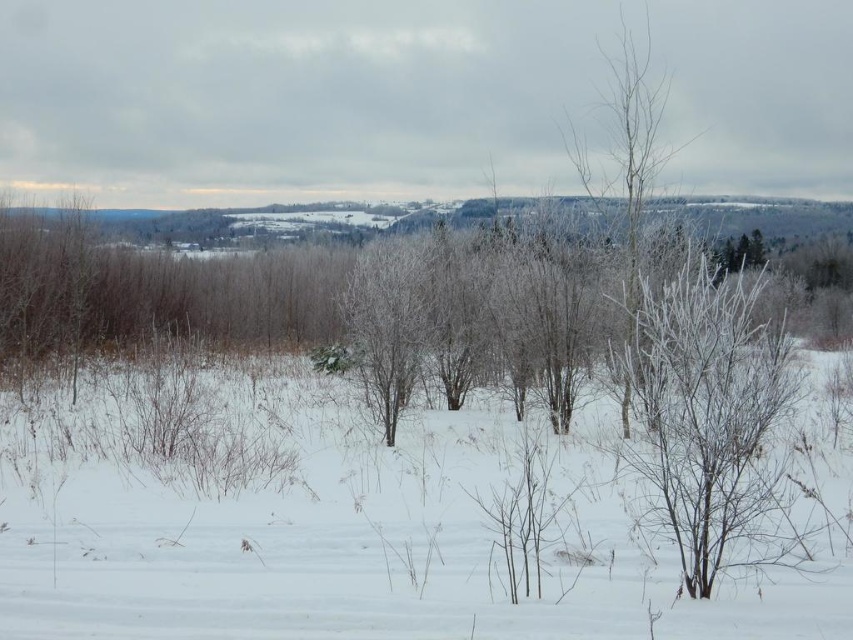
Question: Which of the following is the farthest from the observer?

Choices:
 (A) frosted branches at right
 (B) frosted white tree at upper right

Answer: (B)

Question: Does frosted branches at right appear on the right side of frosted white tree at upper right?

Choices:
 (A) no
 (B) yes

Answer: (A)

Question: Among these points, which one is farthest from the camera?

Choices:
 (A) (479, 612)
 (B) (572, 138)

Answer: (B)

Question: Does frosted branches at right appear on the right side of frosted white tree at upper right?

Choices:
 (A) no
 (B) yes

Answer: (A)

Question: Observing the image, what is the correct spatial positioning of white fluffy snow at center in reference to frosted branches at right?

Choices:
 (A) below
 (B) above

Answer: (A)

Question: Which point is farther to the camera?

Choices:
 (A) (190, 524)
 (B) (692, 579)
 (C) (624, 22)

Answer: (C)